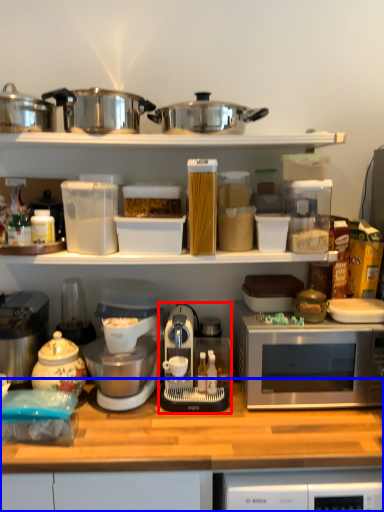
Question: Which of the following is the farthest to the observer, appliance (highlighted by a red box) or countertop (highlighted by a blue box)?

Choices:
 (A) appliance
 (B) countertop

Answer: (A)